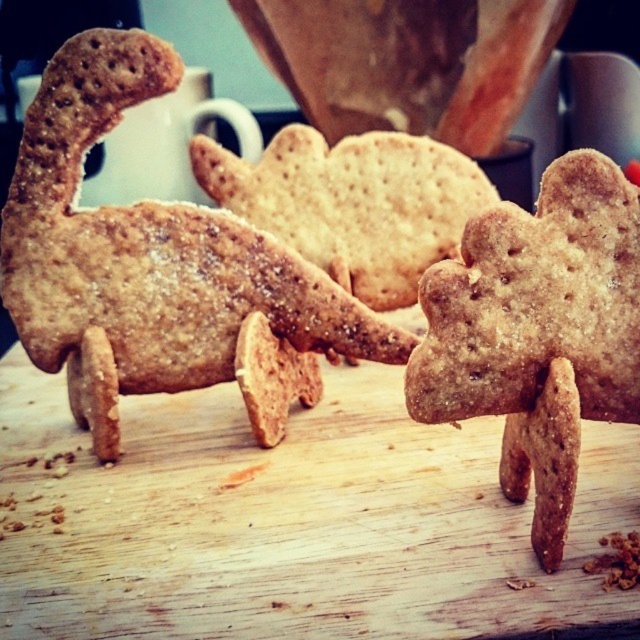
You are a baker who wants to place a chocolate chip on the exact center of the matte brown cookie at center. You have a coordinate system where the bottom left corner of the wooden surface is the origin point. Can you confirm if the point at coordinates (157, 268) is the center of the matte brown cookie at center?

The point at coordinates (157, 268) is on the matte brown cookie at center, so it is the center of the matte brown cookie at center.

You are holding a ruler and want to measure the distance from your current position to the point marked at coordinates [410,600] on the image. What is the actual distance in inches between you and that point?

The actual distance between you and the point marked at coordinates [410,600] is 28.19 inches.

You are a baker who needs to reach for the matte brown cookie at center from your current position. If your hand can extend 80 centimeters forward, will you be able to reach it without moving closer?

The matte brown cookie at center is 87.52 centimeters away from the viewer. Since your hand can only extend 80 centimeters, you will not be able to reach it without moving closer.